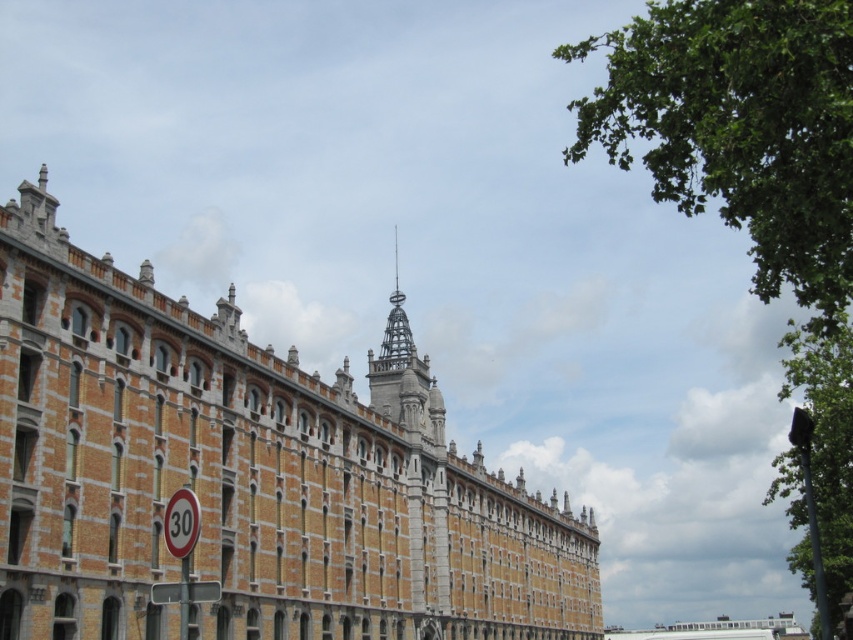
Can you confirm if brick building at center is positioned to the left of white plastic sign at lower left?

In fact, brick building at center is to the right of white plastic sign at lower left.

Is brick building at center bigger than white plastic sign at lower left?

Indeed, brick building at center has a larger size compared to white plastic sign at lower left.

Is point (244, 368) positioned after point (154, 595)?

Yes.

Where is `brick building at center`? This screenshot has height=640, width=853. brick building at center is located at coordinates (247, 474).

Between brick building at center and metallic yellow speed limit sign at lower left, which one is positioned lower?

brick building at center

Which is behind, point (509, 588) or point (177, 506)?

The point (509, 588) is behind.

Find the location of `brick building at center`. brick building at center is located at coordinates (247, 474).

Is point (167, 509) more distant than point (154, 595)?

That is True.

Does metallic yellow speed limit sign at lower left appear on the right side of white plastic sign at lower left?

Correct, you'll find metallic yellow speed limit sign at lower left to the right of white plastic sign at lower left.

Is point (172, 532) more distant than point (154, 600)?

No, it is not.

The width and height of the screenshot is (853, 640). What are the coordinates of `metallic yellow speed limit sign at lower left` in the screenshot? It's located at (181, 522).